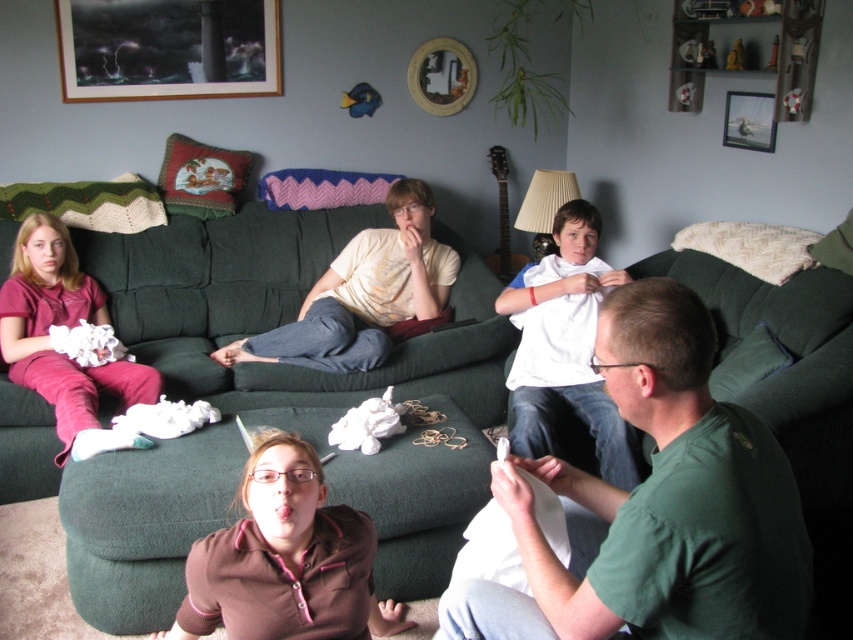
Between brown fleece at center and wooden picture frame at upper right, which one is positioned lower?

Positioned lower is brown fleece at center.

Looking at this image, who is more forward, (306,618) or (752,147)?

Positioned in front is point (306,618).

Find the location of a particular element. Image resolution: width=853 pixels, height=640 pixels. brown fleece at center is located at coordinates (285, 560).

Locate an element on the screen. brown fleece at center is located at coordinates (285, 560).

Between green matte shirt at lower right and wooden picture frame at upper right, which one has more height?

With more height is green matte shirt at lower right.

Is point (726, 458) positioned after point (749, 96)?

No, (726, 458) is closer to viewer.

In order to click on green matte shirt at lower right in this screenshot , I will do `click(656, 506)`.

Can you confirm if green fabric couch at center is positioned to the right of green matte shirt at lower right?

No, green fabric couch at center is not to the right of green matte shirt at lower right.

At what (x,y) coordinates should I click in order to perform the action: click on green fabric couch at center. Please return your answer as a coordinate pair (x, y). Looking at the image, I should click on (309, 369).

Identify the location of green fabric couch at center. (309, 369).

Identify the location of green fabric couch at center. (309, 369).